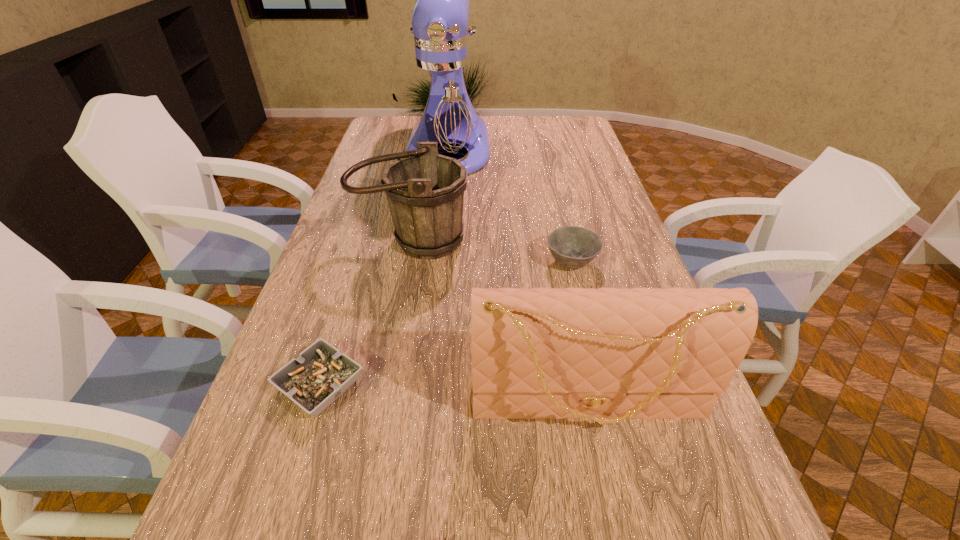
The height and width of the screenshot is (540, 960). Identify the location of vacant region located on the back of the shortest object. (337, 330).

In order to click on object present at the far edge in this screenshot , I will do `click(442, 98)`.

The height and width of the screenshot is (540, 960). In order to click on mixer located at the left edge in this screenshot , I will do `click(442, 98)`.

Where is `bucket that is at the left edge`? This screenshot has width=960, height=540. bucket that is at the left edge is located at coordinates (425, 190).

Image resolution: width=960 pixels, height=540 pixels. What are the coordinates of `ashtray at the left edge` in the screenshot? It's located at (320, 374).

This screenshot has width=960, height=540. Identify the location of handbag that is at the right edge. (608, 354).

In order to click on bowl that is positioned at the right edge in this screenshot , I will do `click(573, 247)`.

The image size is (960, 540). What are the coordinates of `object at the far left corner` in the screenshot? It's located at (442, 98).

Where is `vacant region at the far edge of the desktop`? This screenshot has width=960, height=540. vacant region at the far edge of the desktop is located at coordinates (538, 126).

Identify the location of vacant area at the left edge of the desktop. Image resolution: width=960 pixels, height=540 pixels. (335, 249).